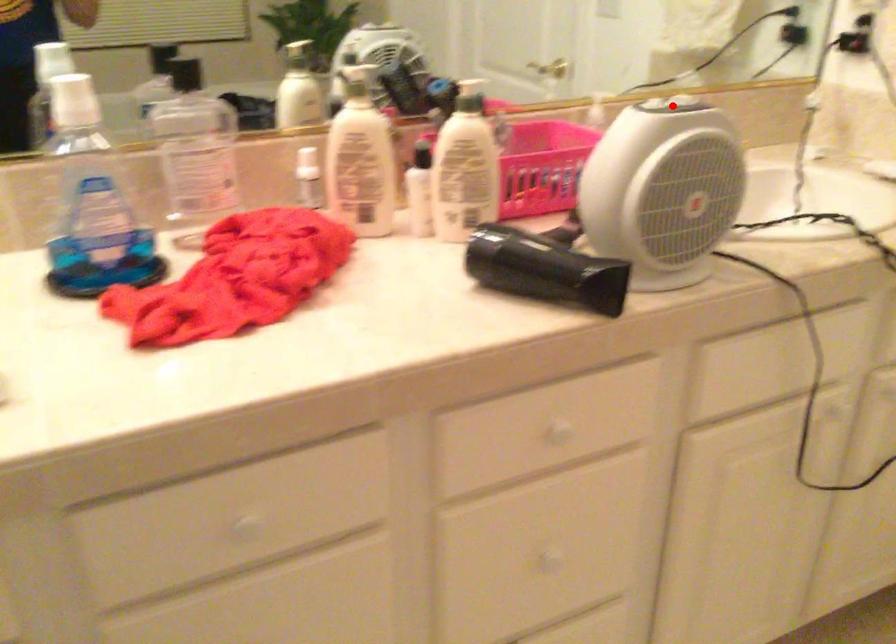
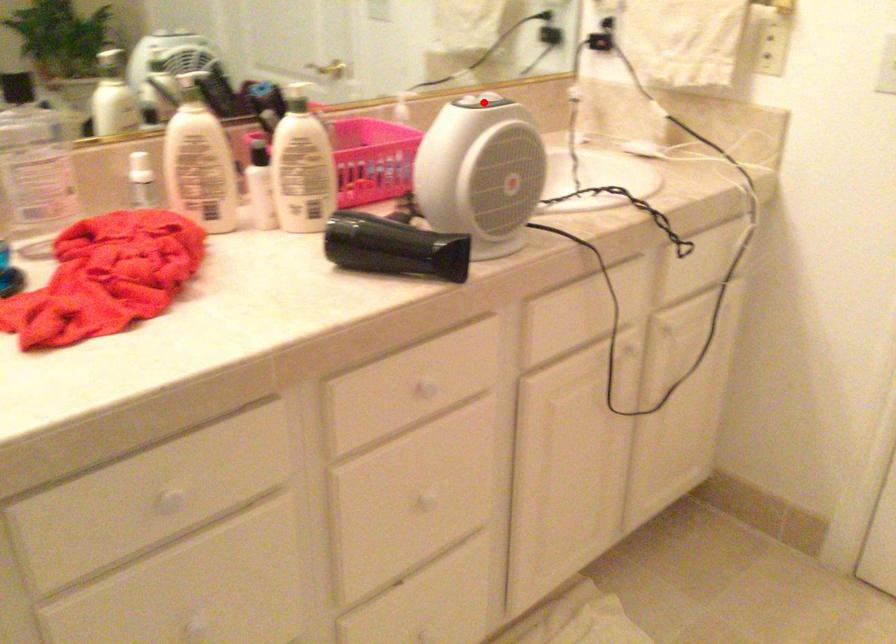
I am providing you with two images of the same scene from different viewpoints. A red point is marked on the first image and another point is marked on the second image. Are the points marked in image1 and image2 representing the same 3D position?

Yes